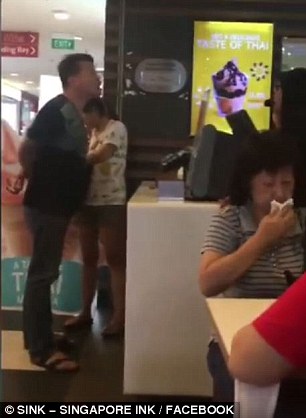
Where is `window`? window is located at coordinates (9, 114).